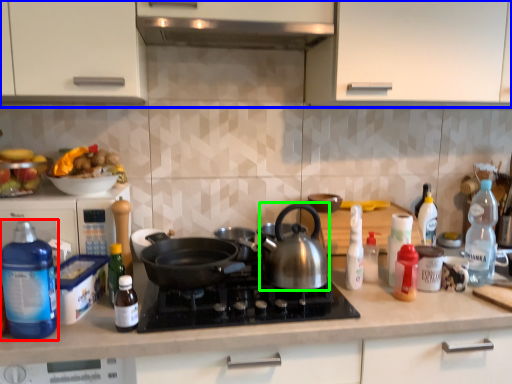
Question: Which object is the closest to the bottle (highlighted by a red box)? Choose among these: cabinetry (highlighted by a blue box) or kitchen appliance (highlighted by a green box).

Choices:
 (A) cabinetry
 (B) kitchen appliance

Answer: (B)